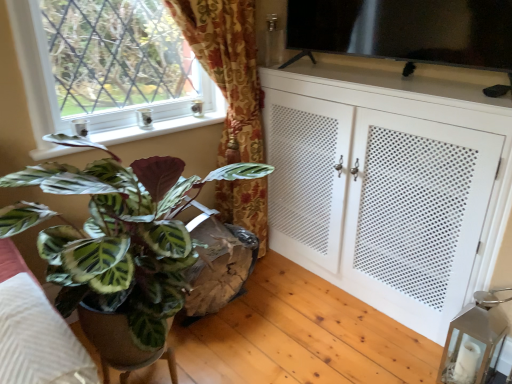
Question: Is white perforated cabinet at right shorter than metallic glass lantern at lower right?

Choices:
 (A) yes
 (B) no

Answer: (B)

Question: From the image's perspective, does white perforated cabinet at right appear higher than metallic glass lantern at lower right?

Choices:
 (A) yes
 (B) no

Answer: (A)

Question: Is white perforated cabinet at right taller than metallic glass lantern at lower right?

Choices:
 (A) yes
 (B) no

Answer: (A)

Question: Does white perforated cabinet at right have a lesser width compared to metallic glass lantern at lower right?

Choices:
 (A) yes
 (B) no

Answer: (B)

Question: From a real-world perspective, is white perforated cabinet at right on top of metallic glass lantern at lower right?

Choices:
 (A) no
 (B) yes

Answer: (B)

Question: Looking at their shapes, would you say transparent glass tv at upper right is wider or thinner than metallic glass lantern at lower right?

Choices:
 (A) thin
 (B) wide

Answer: (B)

Question: From the image's perspective, is transparent glass tv at upper right positioned above or below metallic glass lantern at lower right?

Choices:
 (A) below
 (B) above

Answer: (B)

Question: In the image, is transparent glass tv at upper right on the left side or the right side of metallic glass lantern at lower right?

Choices:
 (A) left
 (B) right

Answer: (A)

Question: From a real-world perspective, relative to metallic glass lantern at lower right, is transparent glass tv at upper right vertically above or below?

Choices:
 (A) above
 (B) below

Answer: (A)

Question: Considering the positions of point (174, 274) and point (57, 314), is point (174, 274) closer or farther from the camera than point (57, 314)?

Choices:
 (A) closer
 (B) farther

Answer: (B)

Question: Relative to green leafy plant at lower left, is green marbled leaf at left in front or behind?

Choices:
 (A) front
 (B) behind

Answer: (B)

Question: Is green marbled leaf at left inside or outside of green leafy plant at lower left?

Choices:
 (A) inside
 (B) outside

Answer: (B)

Question: Visually, is green marbled leaf at left positioned to the left or to the right of green leafy plant at lower left?

Choices:
 (A) left
 (B) right

Answer: (B)

Question: From the image's perspective, is white glossy window sill at upper left positioned above or below white perforated cabinet at right?

Choices:
 (A) above
 (B) below

Answer: (A)

Question: Is white glossy window sill at upper left wider or thinner than white perforated cabinet at right?

Choices:
 (A) wide
 (B) thin

Answer: (B)